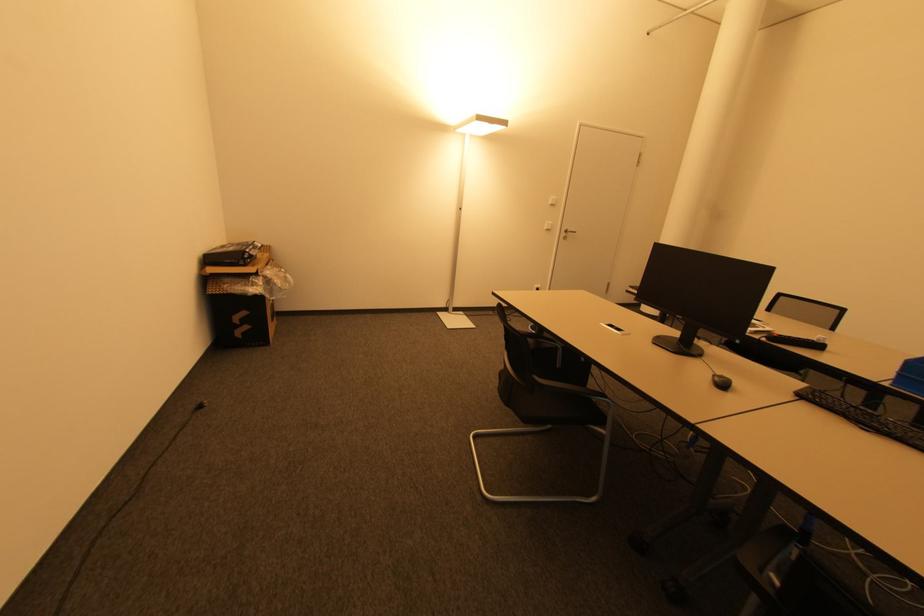
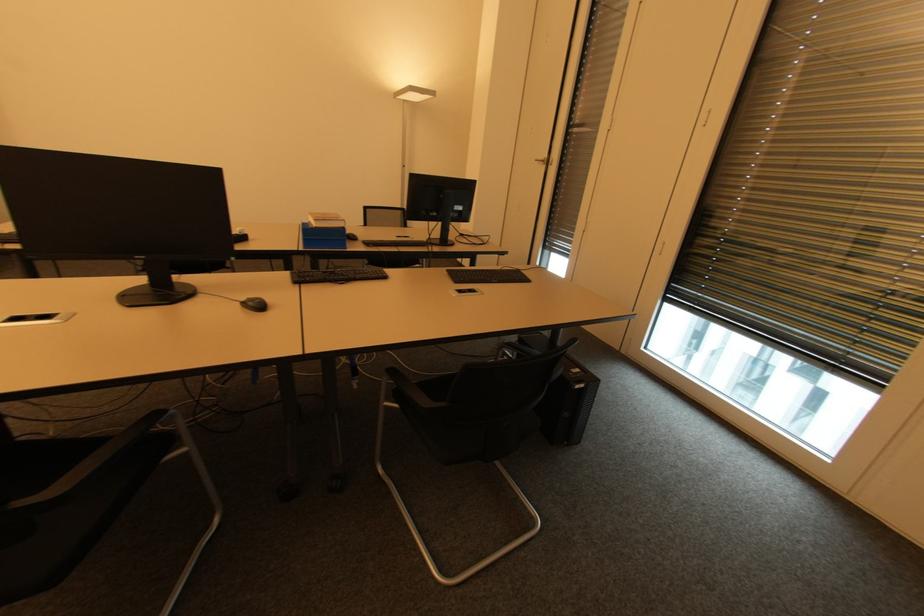
First-person continuous shooting, in which direction is the camera rotating?

The rotation direction of the camera is right-down.